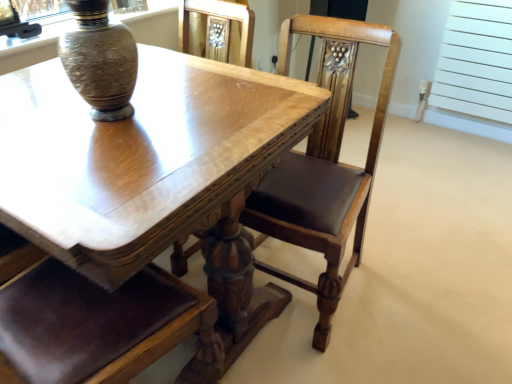
This screenshot has height=384, width=512. What are the coordinates of `free spot in front of speckled ceramic vase at upper left` in the screenshot? It's located at (94, 143).